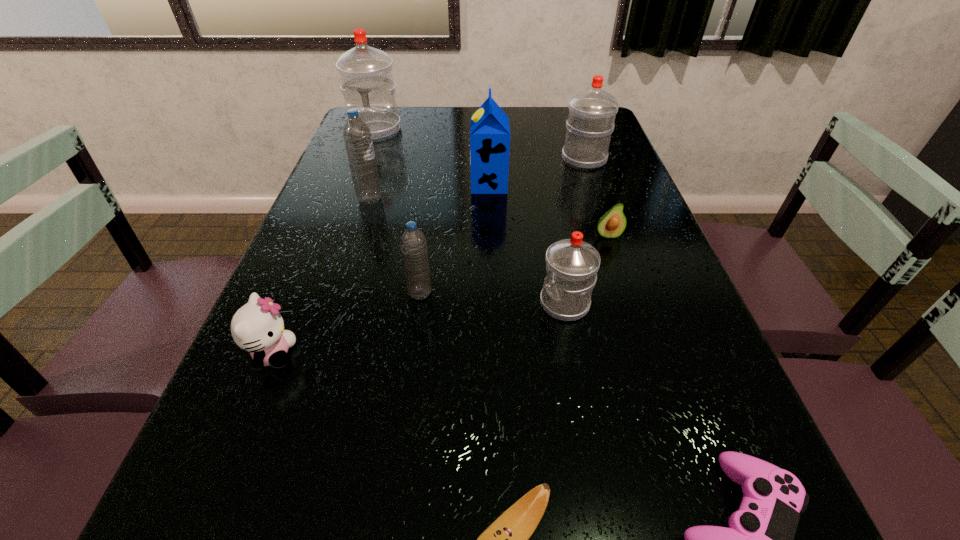
Identify the location of vacant space located on the handle side of the second farthest water bottle. The height and width of the screenshot is (540, 960). (576, 136).

You are a GUI agent. You are given a task and a screenshot of the screen. Output one action in this format:
    pyautogui.click(x=<x>, y=<y>)
    Task: Click on the free region located 0.290m on the handle side of the second farthest water bottle
    The height and width of the screenshot is (540, 960).
    Given the screenshot: What is the action you would take?
    pyautogui.click(x=567, y=109)

The height and width of the screenshot is (540, 960). I want to click on free space located on the front of the left blue water bottle, so click(338, 300).

Image resolution: width=960 pixels, height=540 pixels. In order to click on free region located 0.340m on the handle side of the nearest white water bottle in this screenshot , I will do `click(372, 304)`.

This screenshot has width=960, height=540. Find the location of `blank space located 0.290m on the handle side of the nearest white water bottle`. blank space located 0.290m on the handle side of the nearest white water bottle is located at coordinates (396, 304).

The height and width of the screenshot is (540, 960). Find the location of `vacant region located 0.090m on the handle side of the nearest white water bottle`. vacant region located 0.090m on the handle side of the nearest white water bottle is located at coordinates (495, 304).

In order to click on vacant space positioned on the right of the nearer blue water bottle in this screenshot , I will do `click(590, 293)`.

This screenshot has height=540, width=960. Identify the location of vacant position located on the front-facing side of the white kitten. (465, 354).

Find the location of a particular element. This screenshot has height=540, width=960. vacant space located 0.120m on the cut side of the sixth nearest object is located at coordinates (621, 276).

You are a GUI agent. You are given a task and a screenshot of the screen. Output one action in this format:
    pyautogui.click(x=<x>, y=<y>)
    Task: Click on the object that is at the far edge
    Image resolution: width=960 pixels, height=540 pixels.
    Given the screenshot: What is the action you would take?
    pyautogui.click(x=366, y=75)